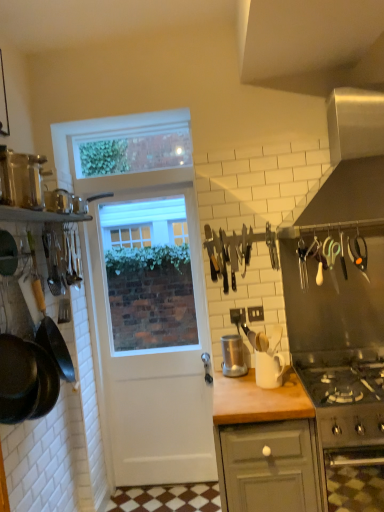
At what (x,y) coordinates should I click in order to perform the action: click on matte gray cabinet at lower center. Please return your answer as a coordinate pair (x, y). This screenshot has width=384, height=512. Looking at the image, I should click on (266, 445).

Where is `satin silver exhaust hood at upper right`? The image size is (384, 512). satin silver exhaust hood at upper right is located at coordinates (352, 160).

What do you see at coordinates (233, 356) in the screenshot? This screenshot has width=384, height=512. I see `metallic stainless steel blender at center, the 3th kitchen appliance when ordered from front to back` at bounding box center [233, 356].

What do you see at coordinates (133, 151) in the screenshot?
I see `clear plastic window screen at upper center` at bounding box center [133, 151].

This screenshot has height=512, width=384. Find the location of `black metal knife set at center`. black metal knife set at center is located at coordinates (229, 253).

Describe the element at coordinates (345, 406) in the screenshot. The width and height of the screenshot is (384, 512). I see `stainless steel oven at lower right` at that location.

Where is `matte gray cabinet at lower center`? This screenshot has width=384, height=512. matte gray cabinet at lower center is located at coordinates (266, 445).

Considering the relative positions of metallic stainless steel blender at center, which is counted as the 2th kitchen appliance, starting from the top, and satin silver exhaust hood at upper right in the image provided, is metallic stainless steel blender at center, which is counted as the 2th kitchen appliance, starting from the top, in front of satin silver exhaust hood at upper right?

No.

Is metallic stainless steel blender at center, which is counted as the 2th kitchen appliance, starting from the top, outside of satin silver exhaust hood at upper right?

Indeed, metallic stainless steel blender at center, which is counted as the 2th kitchen appliance, starting from the top, is completely outside satin silver exhaust hood at upper right.

Considering the relative positions of metallic stainless steel blender at center, positioned as the 2th kitchen appliance in bottom-to-top order, and satin silver exhaust hood at upper right in the image provided, is metallic stainless steel blender at center, positioned as the 2th kitchen appliance in bottom-to-top order, to the left of satin silver exhaust hood at upper right from the viewer's perspective?

Indeed, metallic stainless steel blender at center, positioned as the 2th kitchen appliance in bottom-to-top order, is positioned on the left side of satin silver exhaust hood at upper right.

Between point (232, 354) and point (376, 146), which one is positioned behind?

The point (232, 354) is behind.

Considering the positions of point (41, 169) and point (240, 240), is point (41, 169) closer or farther from the camera than point (240, 240)?

Point (41, 169) is closer to the camera than point (240, 240).

Between metallic silver canisters at upper left, which is counted as the 3th kitchen appliance, starting from the back, and black metal knife set at center, which one is positioned in front?

metallic silver canisters at upper left, which is counted as the 3th kitchen appliance, starting from the back, is more forward.

Locate an element on the screen. The height and width of the screenshot is (512, 384). tool behind the metallic silver canisters at upper left, which is counted as the 3th kitchen appliance, starting from the back is located at coordinates 229,253.

Is black metal knife set at center at the back of metallic silver canisters at upper left, which is counted as the 3th kitchen appliance, starting from the back?

No.

Which is in front, point (215, 275) or point (241, 371)?

The point (241, 371) is closer to the camera.

Is there a large distance between black metal knife set at center and metallic stainless steel blender at center, arranged as the 2th kitchen appliance when viewed from the right?

No.

Considering the sizes of objects black metal knife set at center and metallic stainless steel blender at center, which is counted as the 2th kitchen appliance, starting from the top, in the image provided, who is bigger, black metal knife set at center or metallic stainless steel blender at center, which is counted as the 2th kitchen appliance, starting from the top,?

With larger size is black metal knife set at center.

Is black metal knife set at center aimed at metallic stainless steel blender at center, the 3th kitchen appliance when ordered from front to back?

No, black metal knife set at center is not oriented towards metallic stainless steel blender at center, the 3th kitchen appliance when ordered from front to back.

Which object is wider, black metal knife set at center or black matte frying pan at left?

With larger width is black matte frying pan at left.

Locate an element on the screen. The image size is (384, 512). frying pan on the left of black metal knife set at center is located at coordinates (25, 380).

Is black metal knife set at center at the right side of black matte frying pan at left?

Yes, black metal knife set at center is to the right of black matte frying pan at left.

Is black metal knife set at center next to black matte frying pan at left and touching it?

No.

You are a GUI agent. You are given a task and a screenshot of the screen. Output one action in this format:
    pyautogui.click(x=<x>, y=<y>)
    Task: Click on the 1st kitchen appliance directly beneath the black matte frying pan at left (from a real-world perspective)
    
    Given the screenshot: What is the action you would take?
    pyautogui.click(x=233, y=356)

Does black matte frying pan at left have a smaller size compared to metallic stainless steel blender at center, the 3th kitchen appliance when ordered from front to back?

No.

Can you confirm if black matte frying pan at left is taller than metallic stainless steel blender at center, arranged as the second kitchen appliance when viewed from the left?

Correct, black matte frying pan at left is much taller as metallic stainless steel blender at center, arranged as the second kitchen appliance when viewed from the left.

Which is more to the left, black matte frying pan at left or metallic stainless steel blender at center, which is counted as the 2th kitchen appliance, starting from the top?

From the viewer's perspective, black matte frying pan at left appears more on the left side.

From a real-world perspective, relative to matte gray cabinet at lower center, is metallic stainless steel blender at center, positioned as the 2th kitchen appliance in bottom-to-top order, vertically above or below?

In terms of real-world spatial position, metallic stainless steel blender at center, positioned as the 2th kitchen appliance in bottom-to-top order, is above matte gray cabinet at lower center.

Measure the distance between metallic stainless steel blender at center, the first kitchen appliance viewed from the back, and matte gray cabinet at lower center.

41.63 centimeters.

Considering the relative sizes of metallic stainless steel blender at center, arranged as the 2th kitchen appliance when viewed from the right, and matte gray cabinet at lower center in the image provided, is metallic stainless steel blender at center, arranged as the 2th kitchen appliance when viewed from the right, taller than matte gray cabinet at lower center?

No.

Is point (245, 364) in front of point (247, 451)?

No, it is not.

In the scene shown: Considering the sizes of objects satin silver exhaust hood at upper right and matte gray cabinet at lower center in the image provided, who is shorter, satin silver exhaust hood at upper right or matte gray cabinet at lower center?

satin silver exhaust hood at upper right is shorter.

Does satin silver exhaust hood at upper right have a greater width compared to matte gray cabinet at lower center?

In fact, satin silver exhaust hood at upper right might be narrower than matte gray cabinet at lower center.

Considering the relative positions of satin silver exhaust hood at upper right and matte gray cabinet at lower center in the image provided, is satin silver exhaust hood at upper right behind matte gray cabinet at lower center?

No, satin silver exhaust hood at upper right is closer to the viewer.

Is satin silver exhaust hood at upper right oriented away from matte gray cabinet at lower center?

satin silver exhaust hood at upper right does not have its back to matte gray cabinet at lower center.

Find the location of `the 2nd kitchen appliance directly beneath the satin silver exhaust hood at upper right (from a real-world perspective)`. the 2nd kitchen appliance directly beneath the satin silver exhaust hood at upper right (from a real-world perspective) is located at coordinates (233, 356).

The width and height of the screenshot is (384, 512). I want to click on kitchen appliance above the black metal knife set at center (from the image's perspective), so click(x=21, y=179).

Estimate the real-world distances between objects in this image. Which object is further from metallic stainless steel blender at center, arranged as the second kitchen appliance when viewed from the left, white ceramic mug at center, the 2th kitchen appliance viewed from the back, or metallic silver canisters at upper left, acting as the 1th kitchen appliance starting from the front?

Among the two, metallic silver canisters at upper left, acting as the 1th kitchen appliance starting from the front, is located further to metallic stainless steel blender at center, arranged as the second kitchen appliance when viewed from the left.

Considering their positions, is white ceramic mug at center, which is counted as the second kitchen appliance, starting from the front, positioned closer to clear plastic window screen at upper center than black matte frying pan at left?

Based on the image, black matte frying pan at left appears to be nearer to clear plastic window screen at upper center.

Estimate the real-world distances between objects in this image. Which object is further from white ceramic mug at center, which is counted as the second kitchen appliance, starting from the front, matte gray cabinet at lower center or black matte frying pan at left?

Among the two, black matte frying pan at left is located further to white ceramic mug at center, which is counted as the second kitchen appliance, starting from the front.

Which object lies further to the anchor point metallic silver canisters at upper left, which is the 1th kitchen appliance in left-to-right order, white ceramic mug at center, which is counted as the second kitchen appliance, starting from the front, or white matte door at center?

Among the two, white ceramic mug at center, which is counted as the second kitchen appliance, starting from the front, is located further to metallic silver canisters at upper left, which is the 1th kitchen appliance in left-to-right order.

Based on their spatial positions, is white matte door at center or white ceramic mug at center, which is counted as the second kitchen appliance, starting from the front, further from black metal knife set at center?

white matte door at center lies further to black metal knife set at center than the other object.

From the image, which object appears to be nearer to satin silver exhaust hood at upper right, black matte frying pan at left or clear plastic window screen at upper center?

clear plastic window screen at upper center is closer to satin silver exhaust hood at upper right.

When comparing their distances from matte gray cabinet at lower center, does metallic stainless steel blender at center, arranged as the second kitchen appliance when viewed from the left, or metallic silver canisters at upper left, which is the 1th kitchen appliance in left-to-right order, seem closer?

metallic stainless steel blender at center, arranged as the second kitchen appliance when viewed from the left, is closer to matte gray cabinet at lower center.

Consider the image. Considering their positions, is white matte door at center positioned closer to black metal knife set at center than black matte frying pan at left?

white matte door at center lies closer to black metal knife set at center than the other object.

Where is `tool between clear plastic window screen at upper center and matte gray cabinet at lower center vertically`? tool between clear plastic window screen at upper center and matte gray cabinet at lower center vertically is located at coordinates (229, 253).

The image size is (384, 512). In order to click on tool between clear plastic window screen at upper center and stainless steel oven at lower right in the up-down direction in this screenshot , I will do pyautogui.click(x=229, y=253).

Locate an element on the screen. cabinetry between black matte frying pan at left and white ceramic mug at center, which is the 1th kitchen appliance in bottom-to-top order, in the horizontal direction is located at coordinates (266, 445).

I want to click on tool between black matte frying pan at left and white matte door at center from front to back, so click(229, 253).